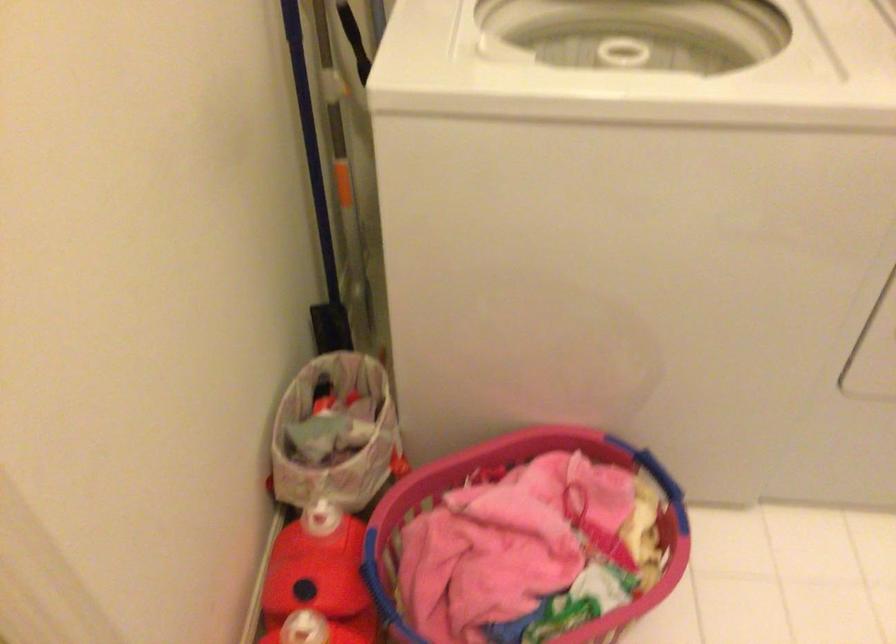
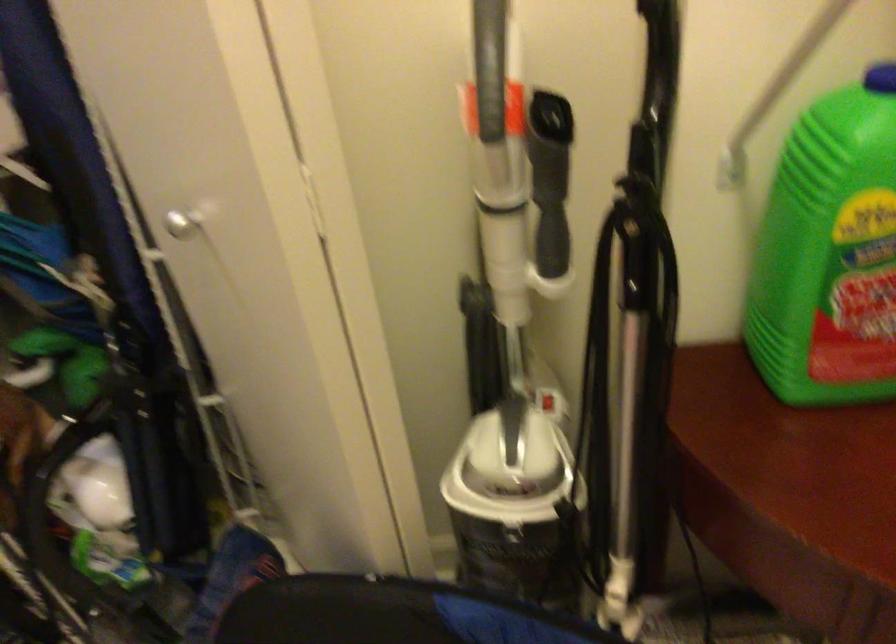
How did the camera likely rotate?

The camera's rotation is toward right-down.